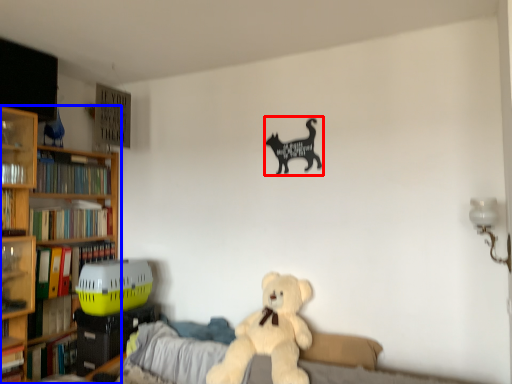
Question: Which of the following is the farthest to the observer, animal (highlighted by a red box) or bookcase (highlighted by a blue box)?

Choices:
 (A) animal
 (B) bookcase

Answer: (B)